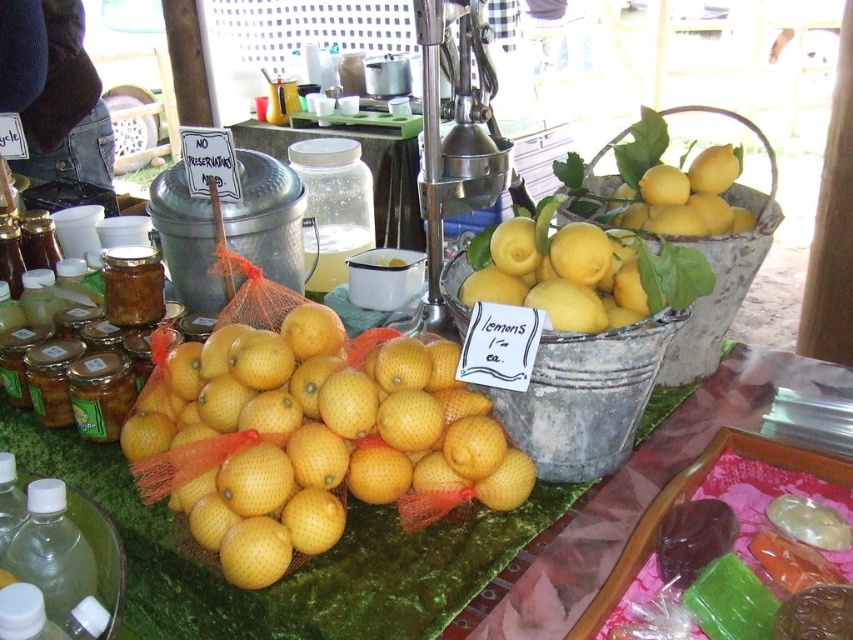
Question: Which of these objects is positioned closest to the clear glass jar at center?

Choices:
 (A) yellow matte lemons at center
 (B) clear plastic bottle at lower left

Answer: (A)

Question: Does yellow matte lemons at center have a lesser width compared to clear plastic bottle at lower left?

Choices:
 (A) yes
 (B) no

Answer: (B)

Question: Which object appears closest to the camera in this image?

Choices:
 (A) yellow matte lemons at center
 (B) clear plastic bottle at lower left
 (C) clear glass jar at center

Answer: (B)

Question: Does clear glass jar at center have a lesser width compared to clear plastic bottle at lower left?

Choices:
 (A) no
 (B) yes

Answer: (A)

Question: Which point appears farthest from the camera in this image?

Choices:
 (A) (82, 556)
 (B) (213, 490)

Answer: (B)

Question: Does clear glass jar at center have a lesser width compared to clear plastic bottle at lower left?

Choices:
 (A) no
 (B) yes

Answer: (A)